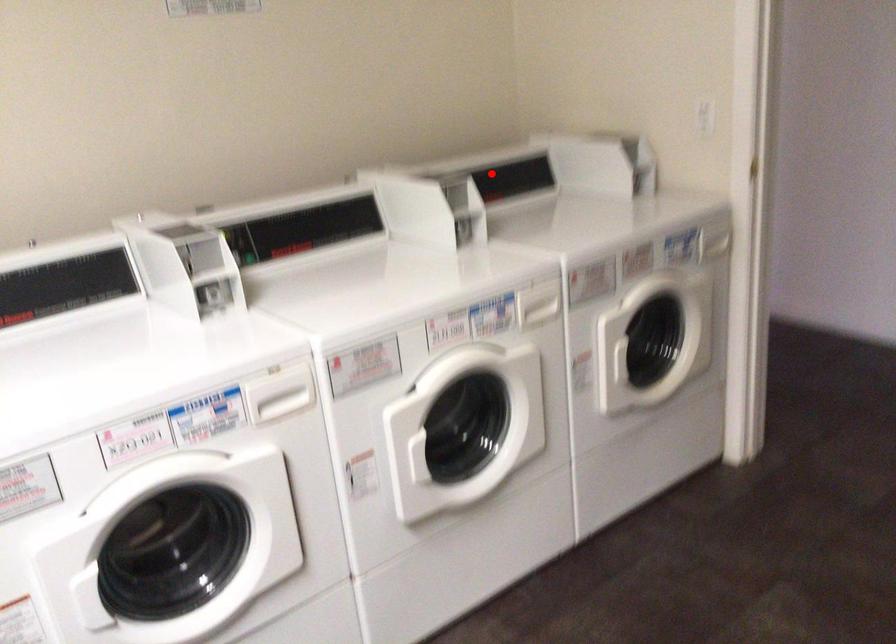
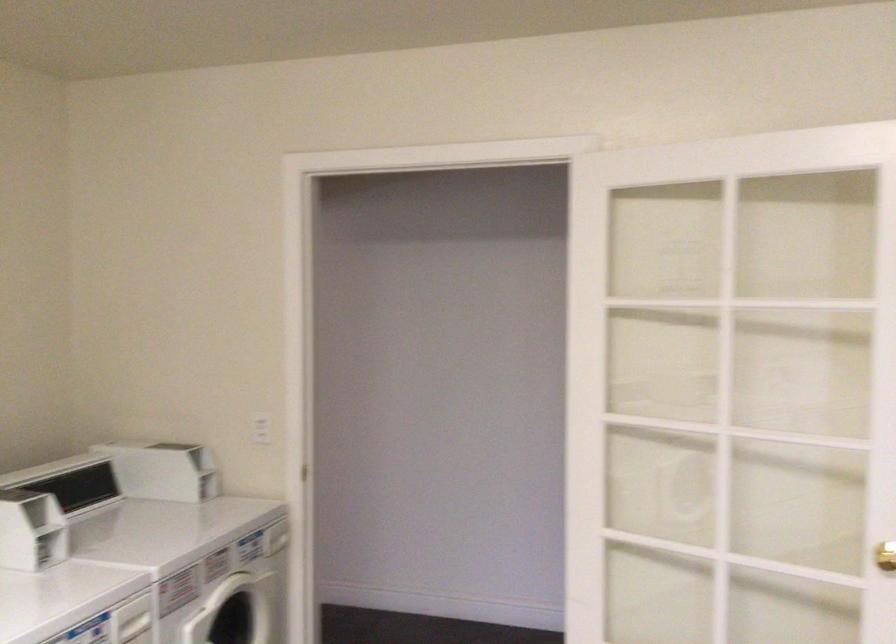
Find the pixel in the second image that matches the highlighted location in the first image.

(70, 482)